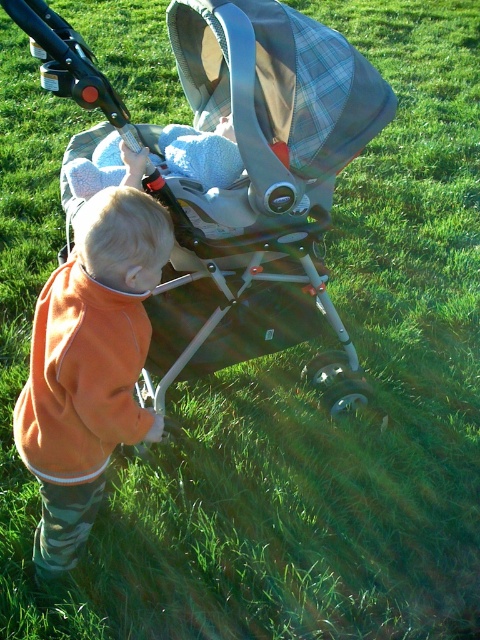
Question: Which is farther from the soft blue blanket at center?

Choices:
 (A) orange fleece jacket at center
 (B) silver metallic stroller at center

Answer: (A)

Question: Estimate the real-world distances between objects in this image. Which object is farther from the orange fleece jacket at center?

Choices:
 (A) silver metallic stroller at center
 (B) soft blue blanket at center

Answer: (B)

Question: Which point is farther from the camera taking this photo?

Choices:
 (A) (336, 120)
 (B) (58, 561)
 (C) (189, 134)

Answer: (C)

Question: Is orange fleece jacket at center thinner than soft blue blanket at center?

Choices:
 (A) no
 (B) yes

Answer: (B)

Question: Does silver metallic stroller at center appear on the right side of soft blue blanket at center?

Choices:
 (A) yes
 (B) no

Answer: (A)

Question: Observing the image, what is the correct spatial positioning of silver metallic stroller at center in reference to soft blue blanket at center?

Choices:
 (A) above
 (B) below

Answer: (B)